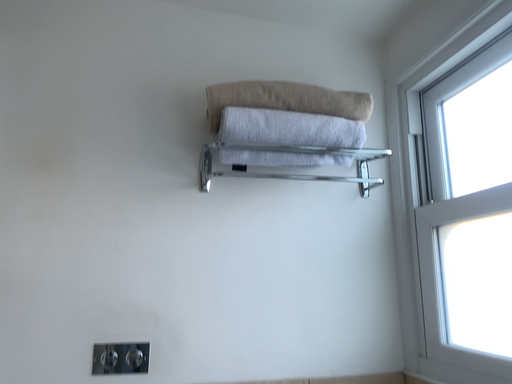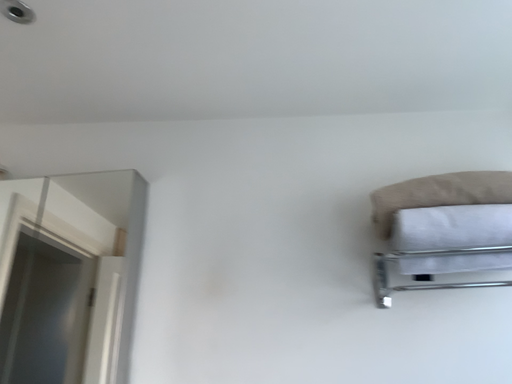
Question: How did the camera likely rotate when shooting the video?

Choices:
 (A) rotated right
 (B) rotated left

Answer: (B)